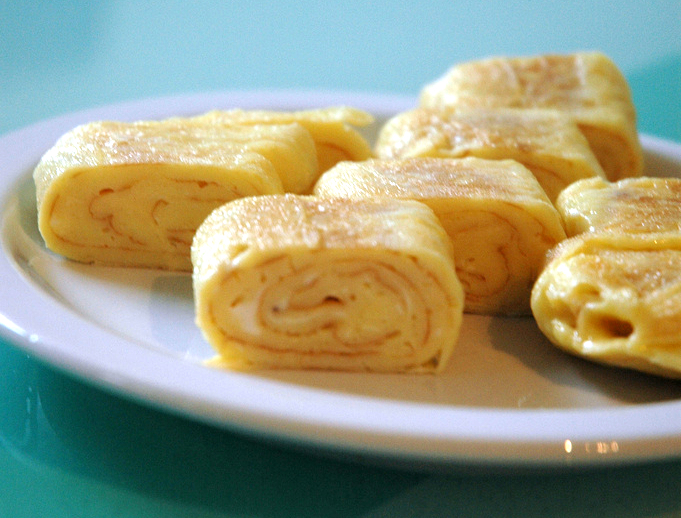
Where is `edge of plate`? edge of plate is located at coordinates (280, 92).